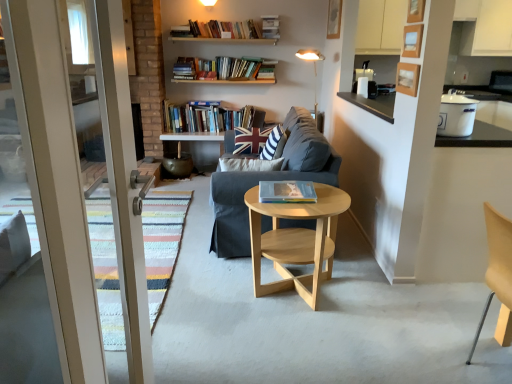
Question: Which direction should I rotate to look at hardcover books at upper center, the 1th book when ordered from left to right?

Choices:
 (A) right
 (B) left

Answer: (B)

Question: Can you confirm if white fabric lampshade at upper center is smaller than dark gray fabric couch at center?

Choices:
 (A) yes
 (B) no

Answer: (A)

Question: Is white fabric lampshade at upper center not inside dark gray fabric couch at center?

Choices:
 (A) no
 (B) yes

Answer: (B)

Question: Considering the relative sizes of white fabric lampshade at upper center and dark gray fabric couch at center in the image provided, is white fabric lampshade at upper center taller than dark gray fabric couch at center?

Choices:
 (A) no
 (B) yes

Answer: (B)

Question: Is white fabric lampshade at upper center oriented away from dark gray fabric couch at center?

Choices:
 (A) no
 (B) yes

Answer: (A)

Question: Does white fabric lampshade at upper center turn towards dark gray fabric couch at center?

Choices:
 (A) yes
 (B) no

Answer: (A)

Question: Can you confirm if white fabric lampshade at upper center is thinner than dark gray fabric couch at center?

Choices:
 (A) yes
 (B) no

Answer: (A)

Question: Is dark gray fabric couch at center behind white enamel pot at upper right?

Choices:
 (A) no
 (B) yes

Answer: (B)

Question: Is dark gray fabric couch at center outside of white enamel pot at upper right?

Choices:
 (A) no
 (B) yes

Answer: (B)

Question: Is dark gray fabric couch at center facing away from white enamel pot at upper right?

Choices:
 (A) yes
 (B) no

Answer: (A)

Question: Is dark gray fabric couch at center thinner than white enamel pot at upper right?

Choices:
 (A) yes
 (B) no

Answer: (B)

Question: Would you consider dark gray fabric couch at center to be distant from white enamel pot at upper right?

Choices:
 (A) yes
 (B) no

Answer: (B)

Question: Is dark gray fabric couch at center at the right side of white enamel pot at upper right?

Choices:
 (A) no
 (B) yes

Answer: (A)

Question: Is hardcover book at center, positioned as the 2th book in back-to-front order, positioned before union jack fabric pillow at center, positioned as the first pillow in back-to-front order?

Choices:
 (A) no
 (B) yes

Answer: (B)